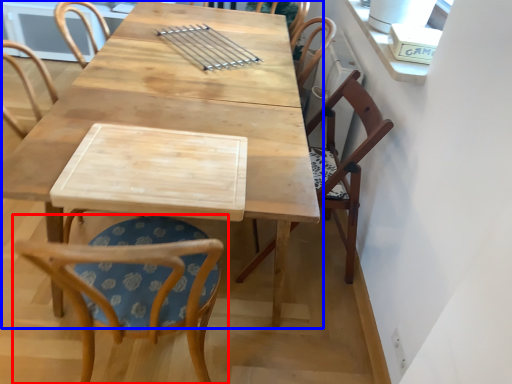
Question: Which object appears farthest to the camera in this image, chair (highlighted by a red box) or table (highlighted by a blue box)?

Choices:
 (A) chair
 (B) table

Answer: (B)